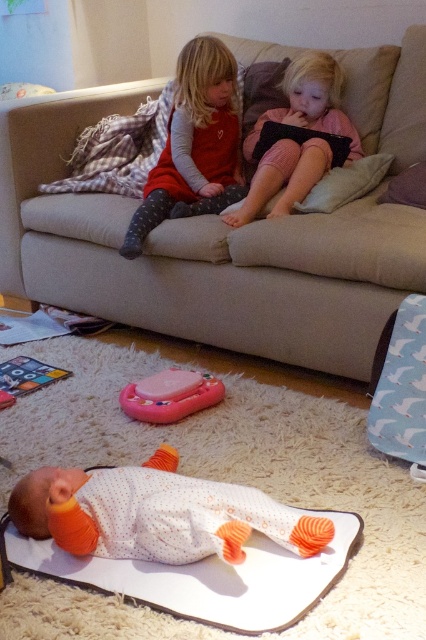
Question: Which object is the farthest from the pink plastic toy at center?

Choices:
 (A) white soft mat at lower center
 (B) pink striped leggings at center
 (C) white dotted fabric baby at center
 (D) matte red dress at upper center

Answer: (B)

Question: Is white soft mat at lower center positioned before matte red dress at upper center?

Choices:
 (A) yes
 (B) no

Answer: (A)

Question: Which point appears farthest from the camera in this image?

Choices:
 (A) (144, 417)
 (B) (184, 244)

Answer: (B)

Question: Considering the real-world distances, which object is closest to the pink plastic toy at center?

Choices:
 (A) purple fabric pillow at upper right
 (B) pink striped leggings at center
 (C) white dotted fabric baby at center

Answer: (C)

Question: From the image, what is the correct spatial relationship of pink plastic toy at center in relation to white soft pillow at center?

Choices:
 (A) right
 (B) left

Answer: (B)

Question: Does white dotted fabric baby at center have a larger size compared to purple fabric pillow at upper right?

Choices:
 (A) no
 (B) yes

Answer: (B)